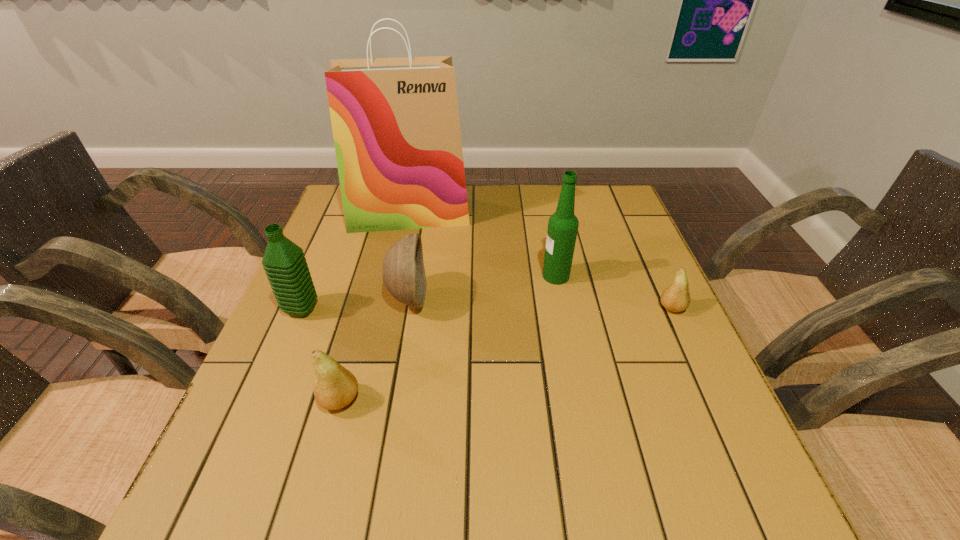
I want to click on vacant space in between the taller pear and the shopping bag, so click(x=374, y=307).

The width and height of the screenshot is (960, 540). Find the location of `object that is the fifth closest to the fifth tallest object`. object that is the fifth closest to the fifth tallest object is located at coordinates (676, 298).

Locate an element on the screen. object that can be found as the fifth closest to the beer bottle is located at coordinates (284, 262).

Find the location of a particular element. The height and width of the screenshot is (540, 960). vacant region that satisfies the following two spatial constraints: 1. on the back side of the third tallest object; 2. on the right side of the shopping bag is located at coordinates (343, 215).

I want to click on vacant region that satisfies the following two spatial constraints: 1. on the back side of the water bottle; 2. on the left side of the third shortest object, so 306,298.